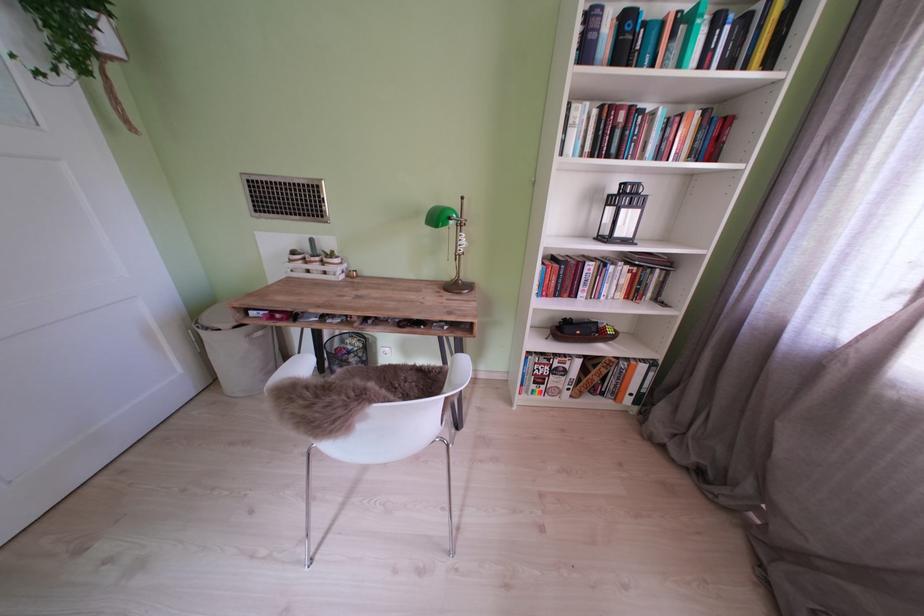
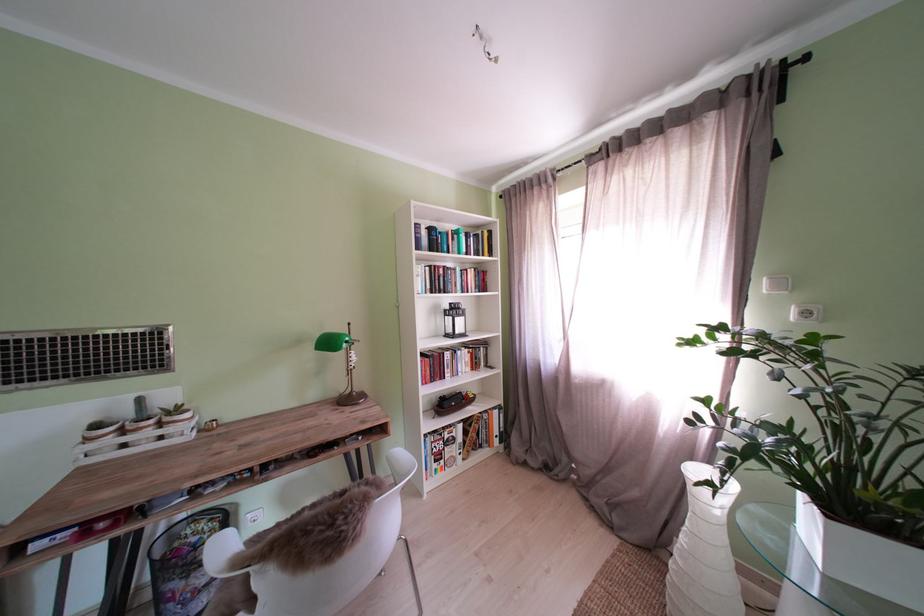
The point at (329, 264) is marked in the first image. Where is the corresponding point in the second image?

(163, 427)